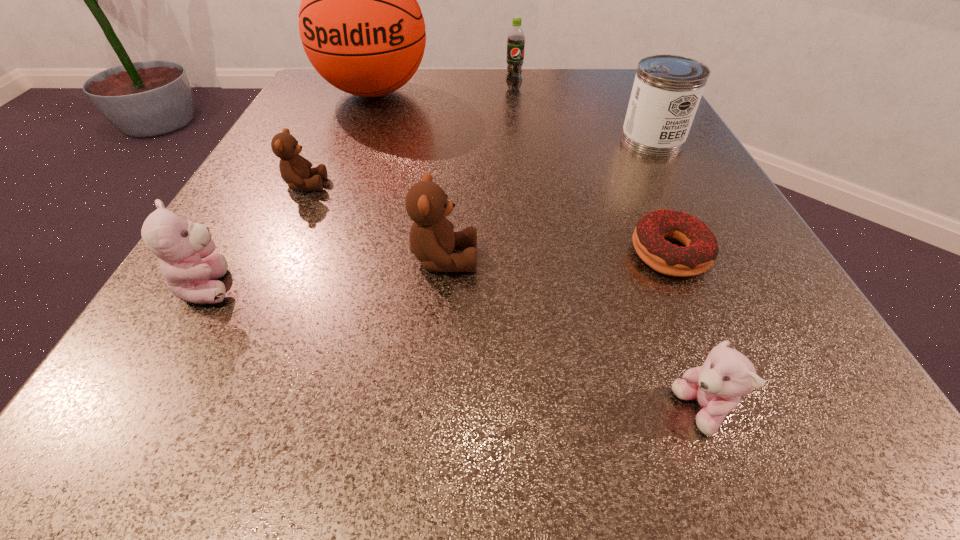
Locate an element on the screen. unoccupied position between the sixth nearest object and the fourth object from right to left is located at coordinates (583, 115).

Identify the location of free space between the fourth object from left to right and the can. The height and width of the screenshot is (540, 960). (548, 200).

Identify the location of vacant area between the left pink teddy bear and the fourth object from right to left. (362, 187).

I want to click on empty space that is in between the farther pink teddy bear and the farthest teddy bear, so click(x=257, y=235).

I want to click on free area in between the doughnut and the right pink teddy bear, so click(x=685, y=332).

Locate an element on the screen. This screenshot has width=960, height=540. object identified as the sixth closest to the second teddy bear from right to left is located at coordinates (361, 27).

Locate which object is the closest to the green soda. Please provide its 2D coordinates. Your answer should be formatted as a tuple, i.e. [(x, y)], where the tuple contains the x and y coordinates of a point satisfying the conditions above.

[(361, 27)]

Point out which teddy bear is positioned as the fourth nearest to the soda. Please provide its 2D coordinates. Your answer should be formatted as a tuple, i.e. [(x, y)], where the tuple contains the x and y coordinates of a point satisfying the conditions above.

[(726, 375)]

Locate an element on the screen. teddy bear that is the closest to the shortest object is located at coordinates pyautogui.click(x=726, y=375).

Image resolution: width=960 pixels, height=540 pixels. I want to click on free space that satisfies the following two spatial constraints: 1. on the front label of the soda; 2. on the right side of the shortest object, so click(534, 253).